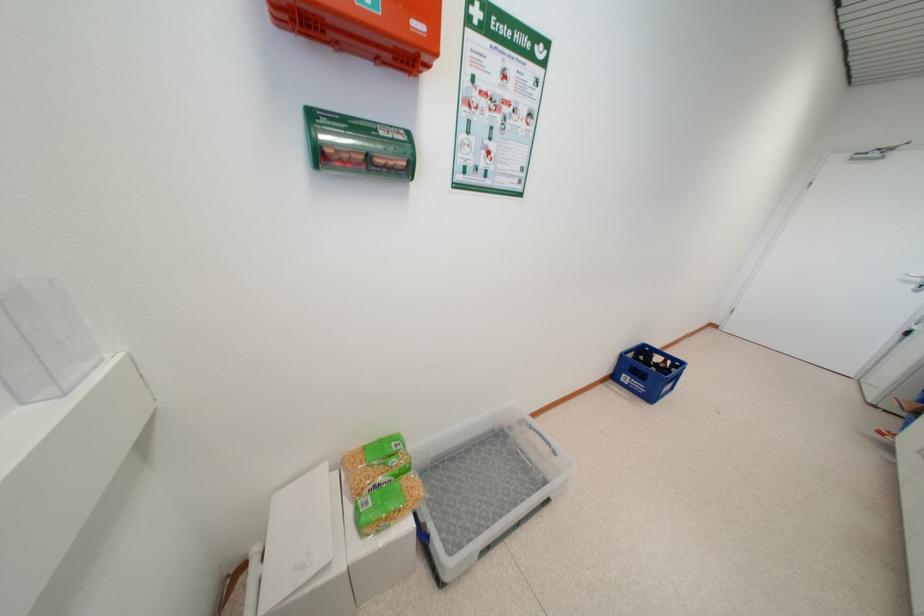
Where would you lift the plastic bin handle? Please return your answer as a coordinate pair (x, y).

(43, 341)